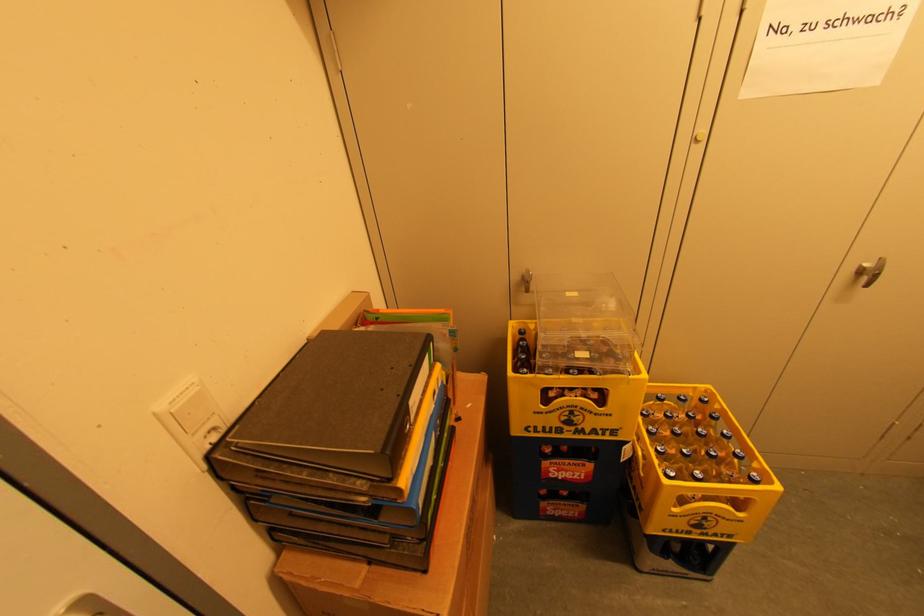
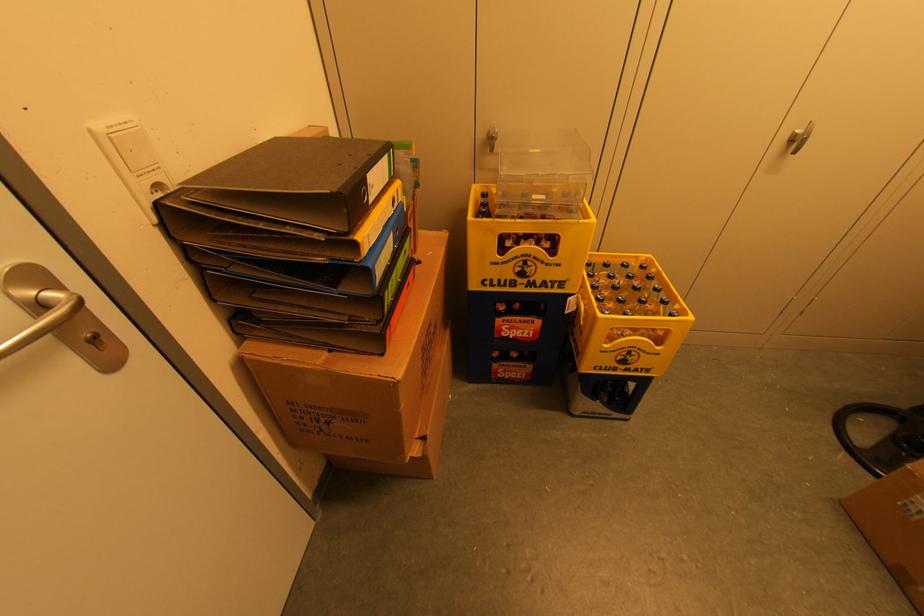
The point at (525, 333) is marked in the first image. Where is the corresponding point in the second image?

(487, 196)